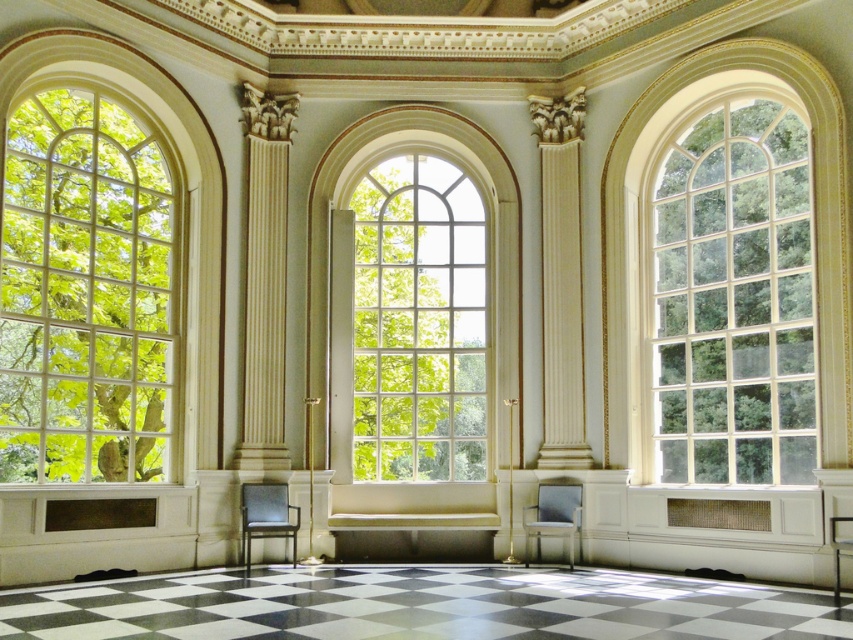
You are standing in the room and want to open the nearest window to let in more light. Which window should you approach, the clear glass window at left or the clear glass window at center?

The clear glass window at left is closer to the viewer than the clear glass window at center, so you should approach the clear glass window at left to open it.

You are an interior designer planning to place a large potted plant between the clear glass window at left and the clear glass window at center. Given the space between them, can you fit the plant without it touching either window?

The clear glass window at left has a lesser width compared to clear glass window at center. However, the description does not provide the exact distance between them, so it is unclear if the plant will fit without touching either window.